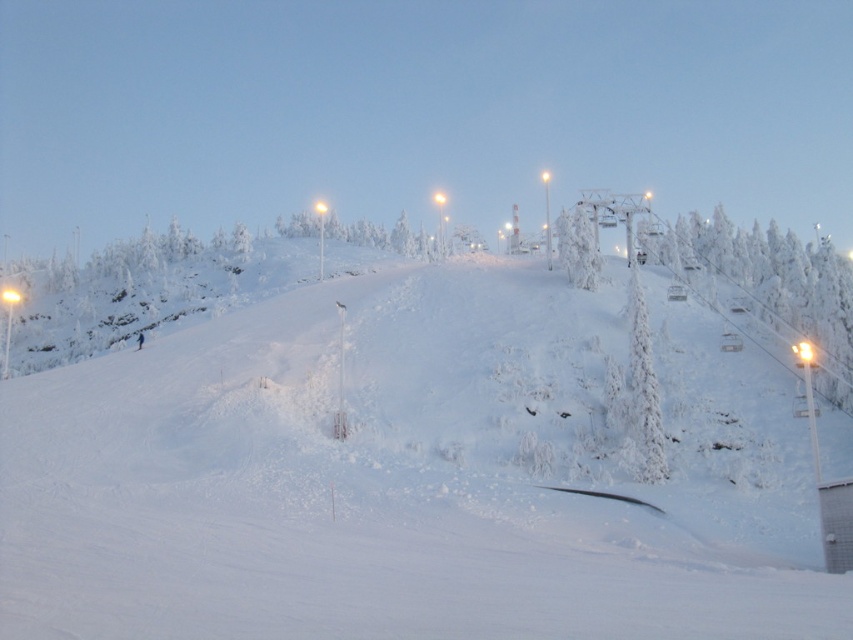
Question: Is white snow ski slope at center behind white frosty tree at upper right?

Choices:
 (A) no
 (B) yes

Answer: (A)

Question: Which point is closer to the camera taking this photo?

Choices:
 (A) (178, 417)
 (B) (578, 218)

Answer: (A)

Question: Which point appears farthest from the camera in this image?

Choices:
 (A) (593, 282)
 (B) (137, 342)
 (C) (839, 358)

Answer: (A)

Question: Is white frosty tree at upper right closer to the viewer compared to blue fabric snowboarder at center?

Choices:
 (A) yes
 (B) no

Answer: (A)

Question: Can you confirm if white snow ski slope at center is smaller than blue fabric snowboarder at center?

Choices:
 (A) no
 (B) yes

Answer: (A)

Question: Which of the following is the closest to the observer?

Choices:
 (A) blue fabric snowboarder at center
 (B) white frosty tree at upper center
 (C) white frosty tree at upper right

Answer: (C)